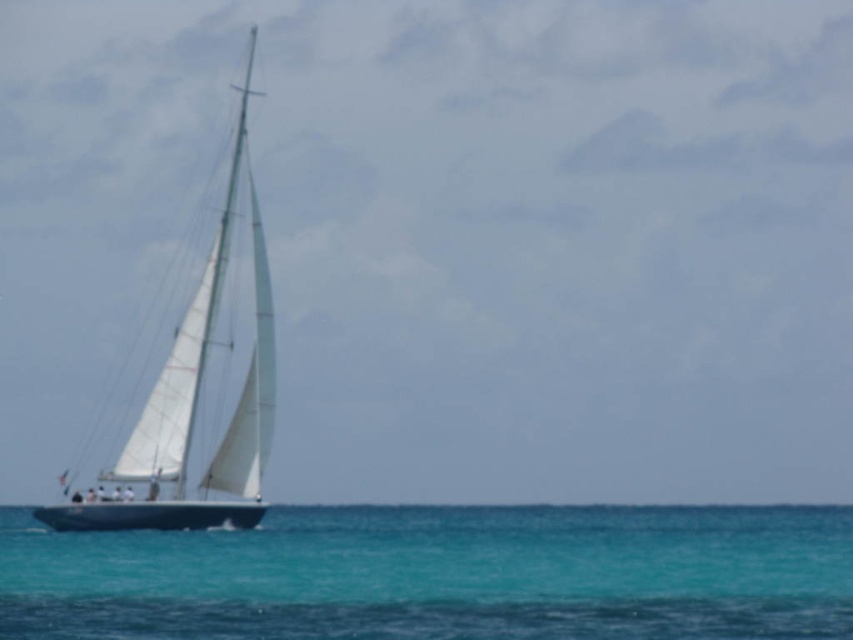
Question: Does clear blue water at center lie behind white matte sailboat at left?

Choices:
 (A) no
 (B) yes

Answer: (A)

Question: Among these points, which one is nearest to the camera?

Choices:
 (A) (775, 536)
 (B) (268, 397)

Answer: (B)

Question: Among these objects, which one is farthest from the camera?

Choices:
 (A) clear blue water at center
 (B) white matte sailboat at left

Answer: (B)

Question: Does clear blue water at center come in front of white matte sailboat at left?

Choices:
 (A) yes
 (B) no

Answer: (A)

Question: Which point is closer to the camera?

Choices:
 (A) (149, 554)
 (B) (231, 458)

Answer: (A)

Question: Is clear blue water at center positioned at the back of white matte sailboat at left?

Choices:
 (A) no
 (B) yes

Answer: (A)